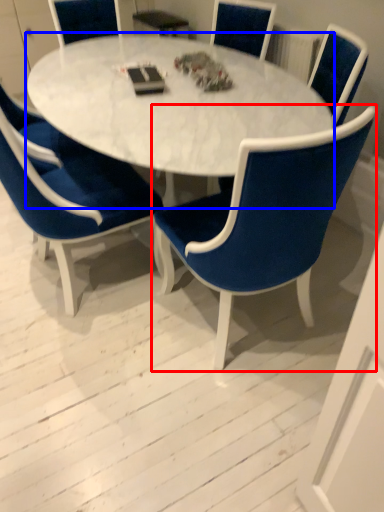
Question: Which object is further to the camera taking this photo, chair (highlighted by a red box) or coffee table (highlighted by a blue box)?

Choices:
 (A) chair
 (B) coffee table

Answer: (B)